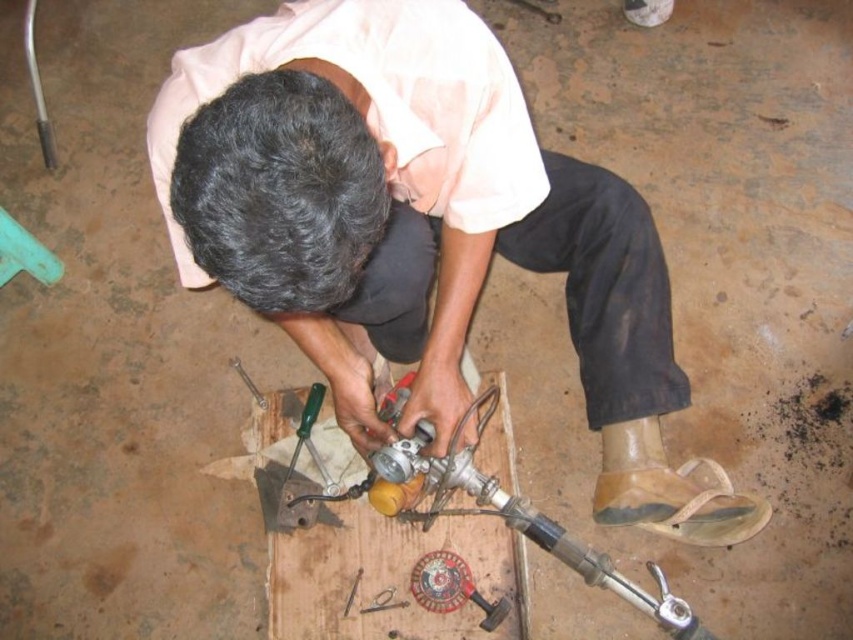
You are a mechanic trying to locate your tools in the workshop. You see the matte black shirt at center and the metallic screwdriver at lower center. Which object is closer to the ceiling?

The matte black shirt at center is taller than the metallic screwdriver at lower center, so the matte black shirt at center is closer to the ceiling.

You are standing in a workshop and need to reach a point that is 1.32 meters away from you. The point is located at coordinates point (386, 317). Can you estimate if you can reach it without moving your feet?

The point (386, 317) is 1.32 meters from viewer. Since the average human arm reach is about 1.2 meters, you might need to adjust your position to reach it.